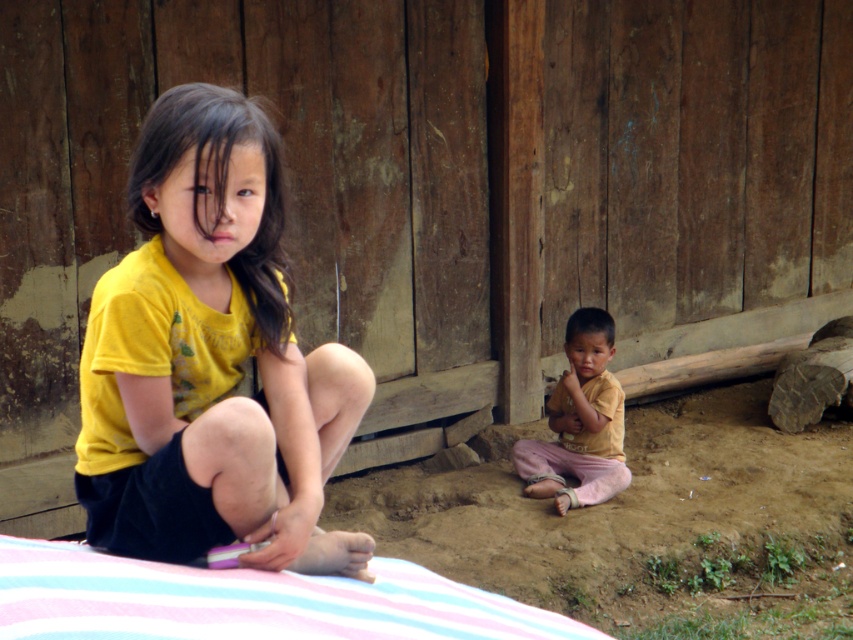
Does pink striped fabric at lower left have a greater width compared to yellow cotton shirt at lower right?

Yes, pink striped fabric at lower left is wider than yellow cotton shirt at lower right.

Does point (177, 572) come in front of point (590, 378)?

Yes, it is in front of point (590, 378).

Does point (9, 620) come closer to viewer compared to point (527, 472)?

That is True.

Identify the location of pink striped fabric at lower left. This screenshot has width=853, height=640. (247, 600).

Does yellow matte shirt at left appear under yellow cotton shirt at lower right?

Incorrect, yellow matte shirt at left is not positioned below yellow cotton shirt at lower right.

Does yellow matte shirt at left appear on the right side of yellow cotton shirt at lower right?

Incorrect, yellow matte shirt at left is not on the right side of yellow cotton shirt at lower right.

This screenshot has width=853, height=640. Find the location of `yellow matte shirt at left`. yellow matte shirt at left is located at coordinates (210, 358).

You are a GUI agent. You are given a task and a screenshot of the screen. Output one action in this format:
    pyautogui.click(x=<x>, y=<y>)
    Task: Click on the yellow matte shirt at left
    This screenshot has width=853, height=640.
    Given the screenshot: What is the action you would take?
    pyautogui.click(x=210, y=358)

Which of these two, yellow matte shirt at left or pink striped fabric at lower left, stands shorter?

pink striped fabric at lower left

Between yellow matte shirt at left and pink striped fabric at lower left, which one appears on the left side from the viewer's perspective?

From the viewer's perspective, yellow matte shirt at left appears more on the left side.

The image size is (853, 640). What are the coordinates of `yellow matte shirt at left` in the screenshot? It's located at (210, 358).

This screenshot has height=640, width=853. Find the location of `yellow matte shirt at left`. yellow matte shirt at left is located at coordinates (210, 358).